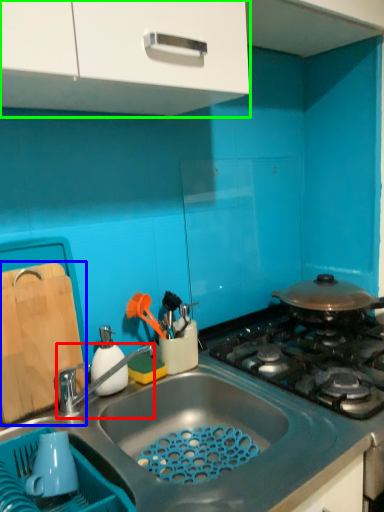
Question: Based on their relative distances, which object is farther from tap (highlighted by a red box)? Choose from cutting board (highlighted by a blue box) and cabinetry (highlighted by a green box).

Choices:
 (A) cutting board
 (B) cabinetry

Answer: (B)